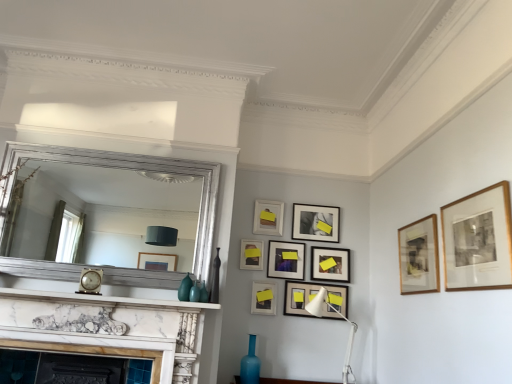
Question: Is point (25, 289) positioned closer to the camera than point (270, 283)?

Choices:
 (A) closer
 (B) farther

Answer: (A)

Question: From a real-world perspective, is marble mantel at center above or below matte black picture frame at center, acting as the seventh picture frame starting from the back?

Choices:
 (A) above
 (B) below

Answer: (B)

Question: Estimate the real-world distances between objects in this image. Which object is closer to the matte black picture frame at lower center, arranged as the sixth picture frame when viewed from the back?

Choices:
 (A) wooden framed artwork at upper right, which is the second picture frame from front to back
 (B) gold-framed print at upper right, acting as the 9th picture frame starting from the back
 (C) silver metallic mirror at upper center
 (D) wooden picture frame at upper center, which is the 2th picture frame from back to front
 (E) white metal table lamp at lower center

Answer: (E)

Question: Which of these objects is positioned closest to the wooden picture frame at upper center, positioned as the 8th picture frame in front-to-back order?

Choices:
 (A) blue glass vase at lower center
 (B) matte teal vase at center, which ranks as the 2th vase in bottom-to-top order
 (C) matte black picture frame at center, marked as the ninth picture frame in a front-to-back arrangement
 (D) matte black picture frame at center, the 6th picture frame in the front-to-back sequence
 (E) white metal table lamp at lower center

Answer: (D)